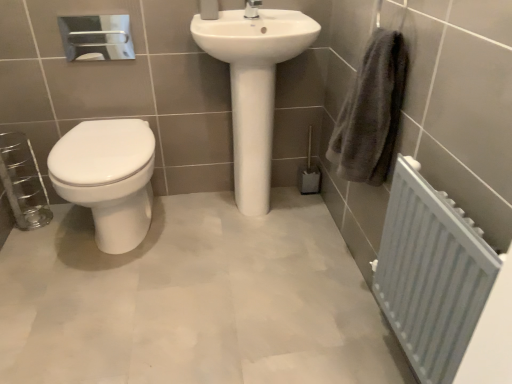
Locate an element on the screen. The image size is (512, 384). free space in front of polished chrome tap at upper center is located at coordinates (249, 19).